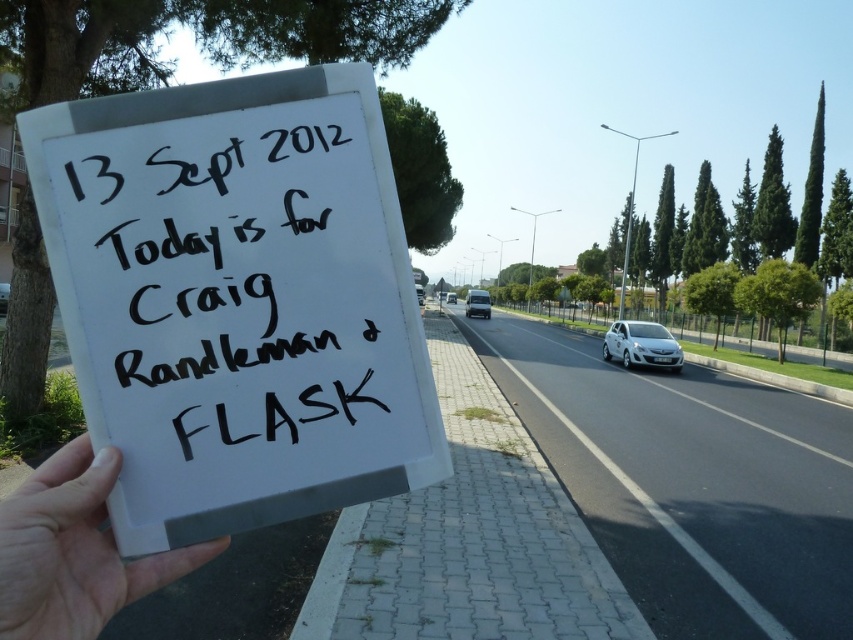
Where is `white metallic car at right`? The height and width of the screenshot is (640, 853). white metallic car at right is located at coordinates (642, 344).

Who is positioned more to the left, white metallic car at right or white plastic van at center?

From the viewer's perspective, white plastic van at center appears more on the left side.

Identify the location of white metallic car at right. The height and width of the screenshot is (640, 853). (642, 344).

Between white glossy car at center and white plastic van at center, which one is positioned higher?

Positioned higher is white plastic van at center.

Does white glossy car at center have a lesser height compared to white plastic van at center?

No.

Where is `white glossy car at center`? white glossy car at center is located at coordinates (419, 294).

Find the location of a particular element. The width and height of the screenshot is (853, 640). white glossy car at center is located at coordinates (419, 294).

Can you confirm if white metallic car at right is shorter than white glossy car at center?

Yes, white metallic car at right is shorter than white glossy car at center.

Does white metallic car at right have a greater width compared to white glossy car at center?

No, white metallic car at right is not wider than white glossy car at center.

Is point (625, 332) farther from camera compared to point (421, 296)?

No, (625, 332) is closer to viewer.

Find the location of a particular element. The height and width of the screenshot is (640, 853). white metallic car at right is located at coordinates (642, 344).